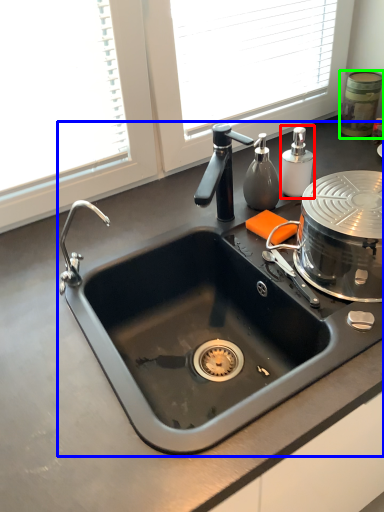
Question: Estimate the real-world distances between objects in this image. Which object is closer to soap dispenser (highlighted by a red box), sink (highlighted by a blue box) or appliance (highlighted by a green box)?

Choices:
 (A) sink
 (B) appliance

Answer: (B)